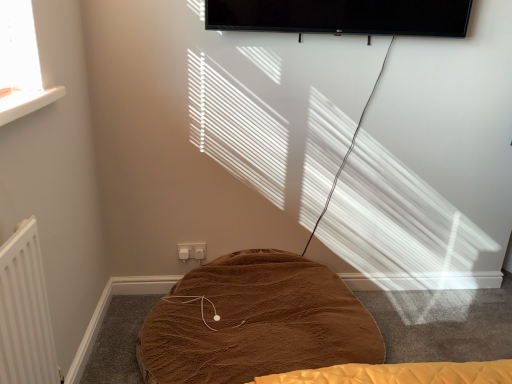
Question: Considering the positions of brown plush blanket at center and white plastic electric outlet at lower center in the image, is brown plush blanket at center taller or shorter than white plastic electric outlet at lower center?

Choices:
 (A) tall
 (B) short

Answer: (A)

Question: Looking at the image, does brown plush blanket at center seem bigger or smaller compared to white plastic electric outlet at lower center?

Choices:
 (A) small
 (B) big

Answer: (B)

Question: Based on their positions, is brown plush blanket at center located to the left or right of white plastic electric outlet at lower center?

Choices:
 (A) left
 (B) right

Answer: (B)

Question: Based on their sizes in the image, would you say white plastic electric outlet at lower center is bigger or smaller than brown plush blanket at center?

Choices:
 (A) big
 (B) small

Answer: (B)

Question: In the image, is white plastic electric outlet at lower center on the left side or the right side of brown plush blanket at center?

Choices:
 (A) right
 (B) left

Answer: (B)

Question: Is white plastic electric outlet at lower center in front of or behind brown plush blanket at center in the image?

Choices:
 (A) front
 (B) behind

Answer: (B)

Question: Does point (196, 253) appear closer or farther from the camera than point (224, 322)?

Choices:
 (A) closer
 (B) farther

Answer: (B)